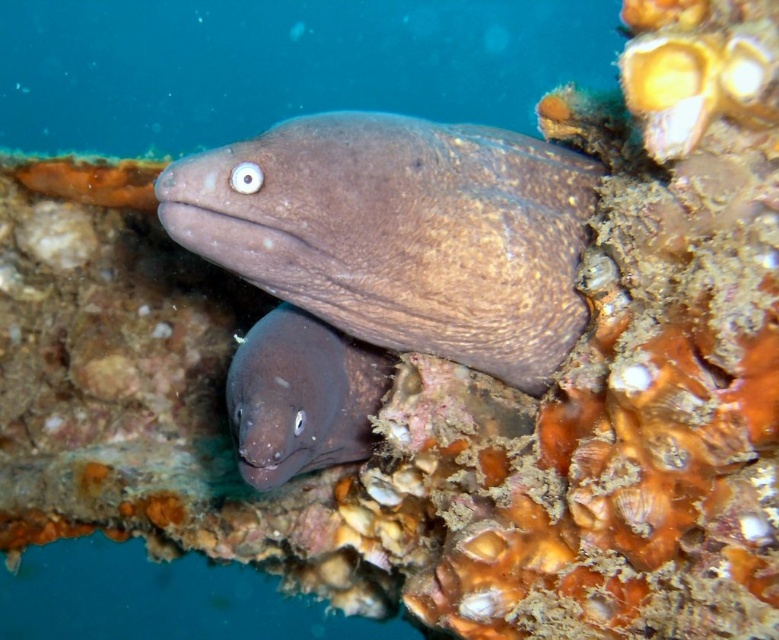
You are a marine biologist observing underwater. You need to locate the brown matte moray at center. What are its coordinates?

The brown matte moray at center is located at coordinates point (400, 232).

Based on the photo, you are a marine biologist observing two points marked in the coral reef. You need to determine which point is closer to your viewpoint. The points are labeled as point (x=577, y=205) and point (x=259, y=358). Which point is closer to you?

Point (x=577, y=205) is further to the viewer than point (x=259, y=358), so the point closer to you is point (x=259, y=358).